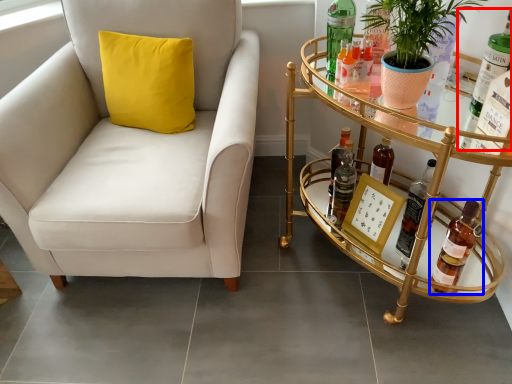
Question: Which of the following is the farthest to the observer, bottle (highlighted by a red box) or bottle (highlighted by a blue box)?

Choices:
 (A) bottle
 (B) bottle

Answer: (B)